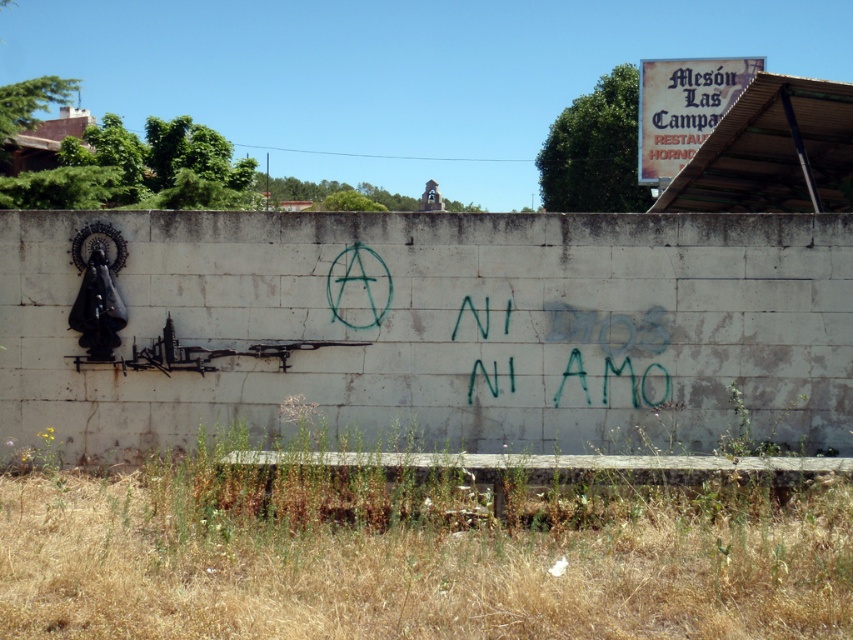
Question: Is white concrete wall at center bigger than green paint at center?

Choices:
 (A) no
 (B) yes

Answer: (B)

Question: Among these objects, which one is farthest from the camera?

Choices:
 (A) green paint at center
 (B) white concrete wall at center

Answer: (A)

Question: Among these points, which one is farthest from the camera?

Choices:
 (A) (518, 326)
 (B) (576, 342)

Answer: (B)

Question: Among these points, which one is nearest to the camera?

Choices:
 (A) (465, 298)
 (B) (416, 388)

Answer: (A)

Question: Is white concrete wall at center thinner than green paint at center?

Choices:
 (A) no
 (B) yes

Answer: (A)

Question: Is white concrete wall at center below green paint at center?

Choices:
 (A) no
 (B) yes

Answer: (A)